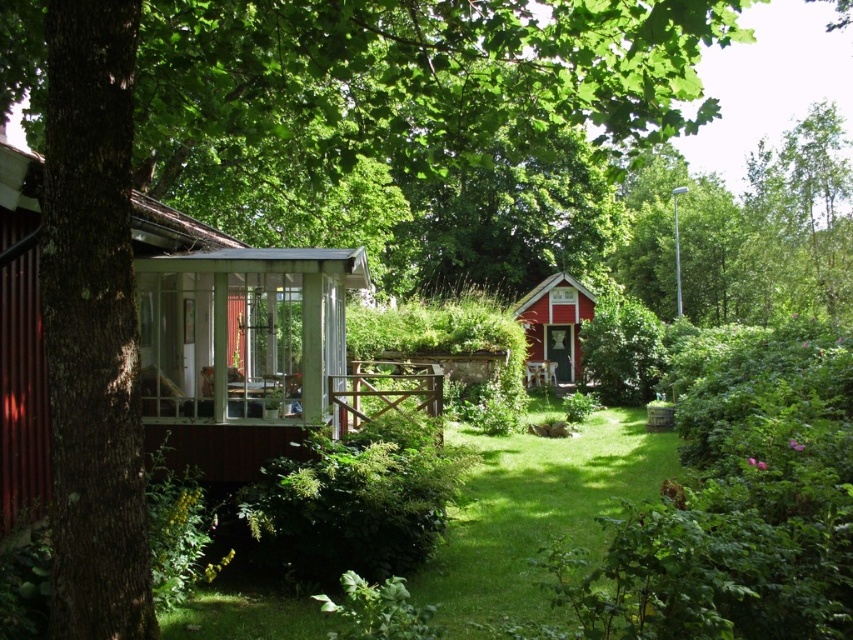
Consider the image. Which is below, green grass at center or matte red wooden cottage at center?

Positioned lower is green grass at center.

Between green grass at center and matte red wooden cottage at center, which one appears on the left side from the viewer's perspective?

green grass at center

Describe the element at coordinates (535, 512) in the screenshot. I see `green grass at center` at that location.

I want to click on green grass at center, so click(535, 512).

Who is lower down, transparent glass porch at center or matte red wooden cottage at center?

transparent glass porch at center

Who is more forward, (368, 364) or (561, 273)?

Positioned in front is point (368, 364).

You are a GUI agent. You are given a task and a screenshot of the screen. Output one action in this format:
    pyautogui.click(x=<x>, y=<y>)
    Task: Click on the transparent glass porch at center
    
    Given the screenshot: What is the action you would take?
    pyautogui.click(x=323, y=396)

Does wooden cottage at left appear on the right side of transparent glass porch at center?

No, wooden cottage at left is not to the right of transparent glass porch at center.

Between point (15, 376) and point (231, 420), which one is positioned behind?

Positioned behind is point (231, 420).

The image size is (853, 640). In order to click on wooden cottage at left in this screenshot , I will do `click(235, 339)`.